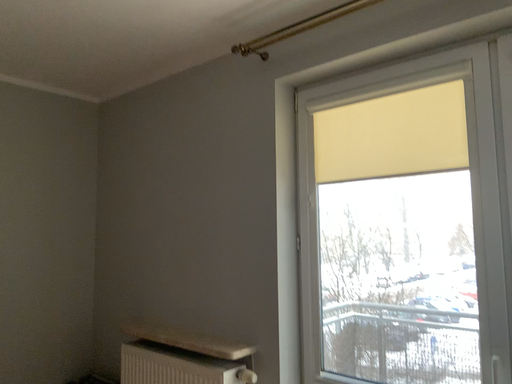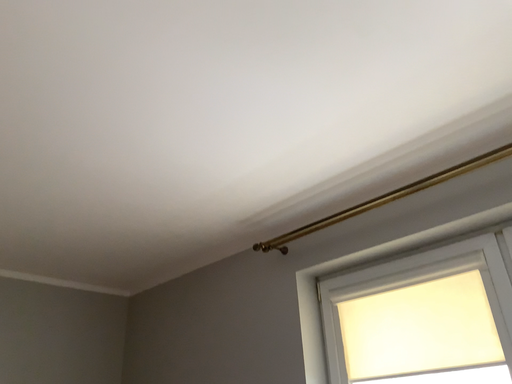
Question: How did the camera likely rotate when shooting the video?

Choices:
 (A) rotated upward
 (B) rotated downward

Answer: (A)